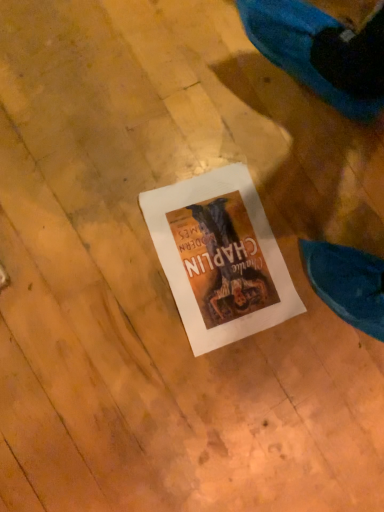
The height and width of the screenshot is (512, 384). What are the coordinates of `free space to the back side of white paper poster at center` in the screenshot? It's located at (315, 183).